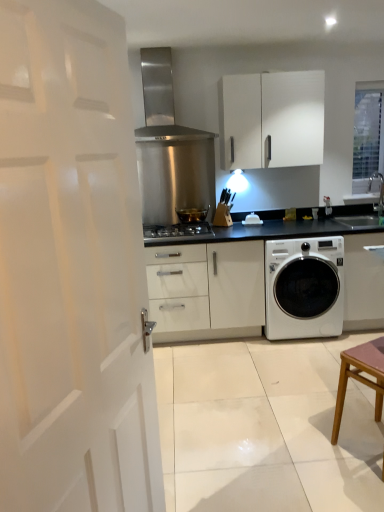
Question: Based on their sizes in the image, would you say white glossy washing machine at lower right is bigger or smaller than white glossy sink at upper right?

Choices:
 (A) small
 (B) big

Answer: (B)

Question: Visually, is white glossy washing machine at lower right positioned to the left or to the right of white glossy sink at upper right?

Choices:
 (A) right
 (B) left

Answer: (B)

Question: Considering the real-world distances, which object is closest to the white matte cabinet at upper center?

Choices:
 (A) white glossy sink at upper right
 (B) stainless steel gas stove at center
 (C) stainless steel range hood at upper center
 (D) clear glass window at upper right
 (E) brown wooden table at lower right

Answer: (C)

Question: Based on their relative distances, which object is farther from the brown wooden table at lower right?

Choices:
 (A) white matte cabinet at upper center
 (B) stainless steel range hood at upper center
 (C) white matte door at left
 (D) shiny metallic bowl at center
 (E) clear glass window at upper right

Answer: (B)